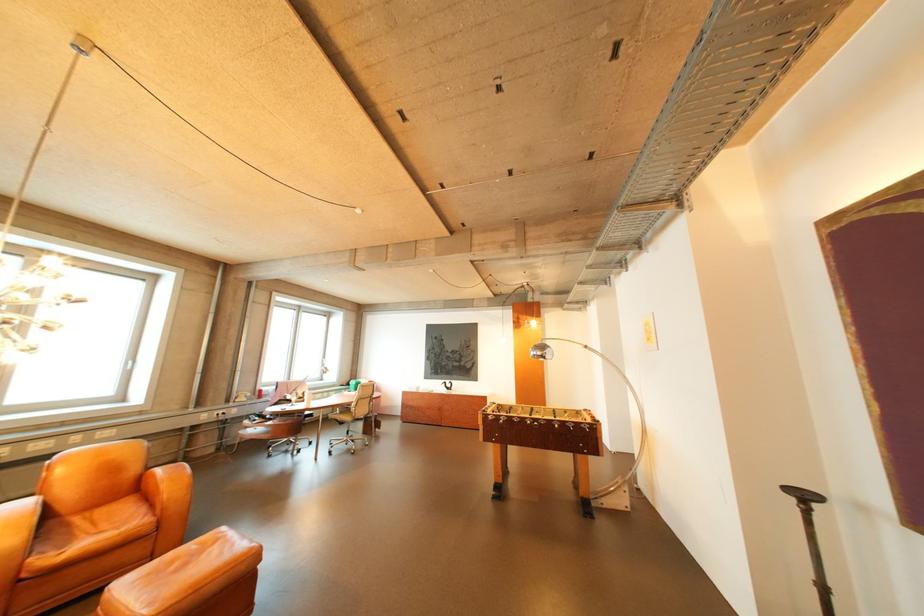
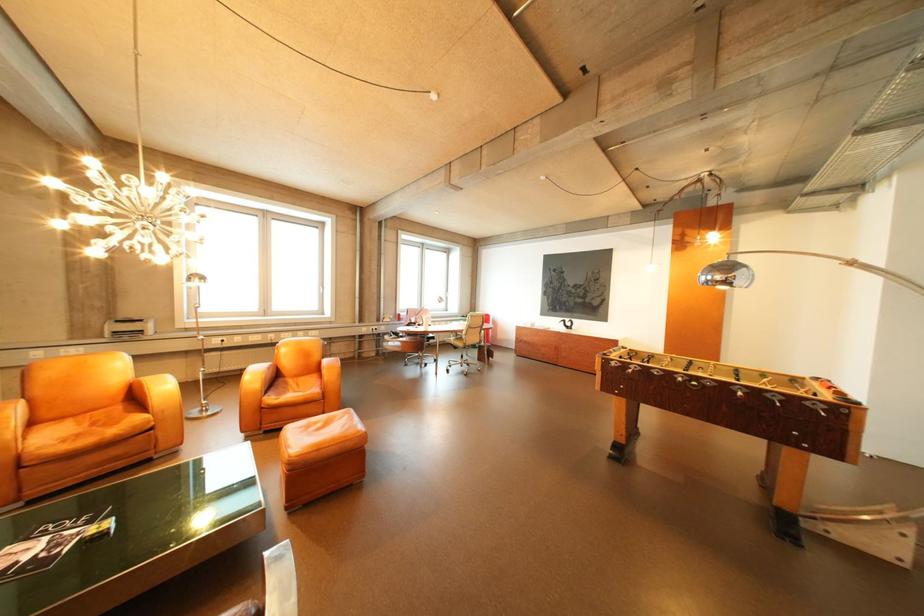
Where in the second image is the point corresponding to the point at 576,424 from the first image?

(769, 392)